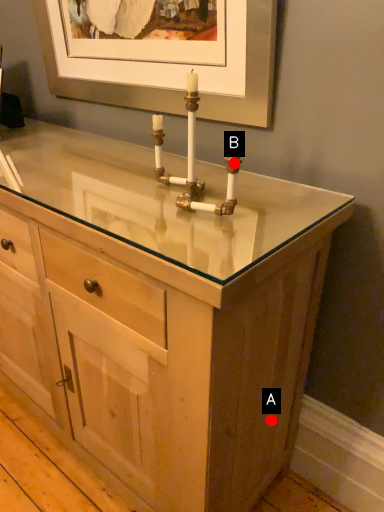
Question: Two points are circled on the image, labeled by A and B beside each circle. Among these points, which one is farthest from the camera?

Choices:
 (A) A is further
 (B) B is further

Answer: (A)